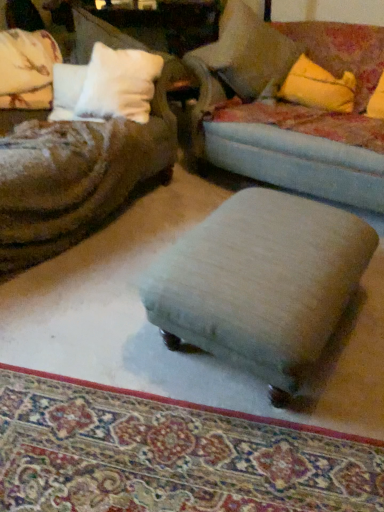
The width and height of the screenshot is (384, 512). What do you see at coordinates (169, 455) in the screenshot?
I see `beige fabric ottoman at center` at bounding box center [169, 455].

How much space does soft beige pillow at upper right, the second pillow in the left-to-right sequence, occupy vertically?

It is 25.10 inches.

What is the approximate height of yellow fabric pillow at upper right?

The height of yellow fabric pillow at upper right is 12.50 inches.

I want to click on velvet blue studio couch at center, so click(299, 162).

Is soft beige pillow at upper right, the second pillow in the left-to-right sequence, located outside velvet blue studio couch at center?

No, soft beige pillow at upper right, the second pillow in the left-to-right sequence, is not entirely external to velvet blue studio couch at center.

Considering the positions of objects soft beige pillow at upper right, the second pillow in the left-to-right sequence, and velvet blue studio couch at center in the image provided, who is in front, soft beige pillow at upper right, the second pillow in the left-to-right sequence, or velvet blue studio couch at center?

velvet blue studio couch at center.

From the image's perspective, which object appears higher, soft beige pillow at upper right, the second pillow in the left-to-right sequence, or velvet blue studio couch at center?

soft beige pillow at upper right, the second pillow in the left-to-right sequence, appears higher in the image.

Considering the positions of objects soft beige pillow at upper right, the second pillow in the left-to-right sequence, and velvet blue studio couch at center in the image provided, who is more to the left, soft beige pillow at upper right, the second pillow in the left-to-right sequence, or velvet blue studio couch at center?

soft beige pillow at upper right, the second pillow in the left-to-right sequence, is more to the left.

Between beige fabric ottoman at center and light beige fabric stool at center, which one has larger width?

light beige fabric stool at center.

How many degrees apart are the facing directions of beige fabric ottoman at center and light beige fabric stool at center?

The angle between the facing direction of beige fabric ottoman at center and the facing direction of light beige fabric stool at center is 159 degrees.

From a real-world perspective, is beige fabric ottoman at center above or below light beige fabric stool at center?

In terms of real-world spatial position, beige fabric ottoman at center is below light beige fabric stool at center.

Which is nearer, (314, 471) or (284, 317)?

Point (314, 471) appears to be farther away from the viewer than point (284, 317).

Would you say beige fabric ottoman at center is inside or outside soft beige pillow at upper right, arranged as the first pillow when viewed from the right?

beige fabric ottoman at center is outside soft beige pillow at upper right, arranged as the first pillow when viewed from the right.

From a real-world perspective, which object rests below the other?

beige fabric ottoman at center, from a real-world perspective.

Is beige fabric ottoman at center positioned far away from soft beige pillow at upper right, the second pillow in the left-to-right sequence?

That's right, there is a large distance between beige fabric ottoman at center and soft beige pillow at upper right, the second pillow in the left-to-right sequence.

Is point (370, 495) positioned before point (244, 66)?

Yes, point (370, 495) is closer to viewer.

Considering the relative sizes of velvet blue studio couch at center and light beige fabric stool at center in the image provided, is velvet blue studio couch at center bigger than light beige fabric stool at center?

Yes.

Is velvet blue studio couch at center positioned with its back to light beige fabric stool at center?

That's not correct — velvet blue studio couch at center is not looking away from light beige fabric stool at center.

Does velvet blue studio couch at center have a greater width compared to light beige fabric stool at center?

Indeed, velvet blue studio couch at center has a greater width compared to light beige fabric stool at center.

Can you confirm if velvet blue studio couch at center is positioned to the left of light beige fabric stool at center?

In fact, velvet blue studio couch at center is to the right of light beige fabric stool at center.

Is white soft pillow at upper left, which appears as the 1th pillow when viewed from the left, far away from yellow fabric pillow at upper right?

No, white soft pillow at upper left, which appears as the 1th pillow when viewed from the left, is not far away from yellow fabric pillow at upper right.

Would you say white soft pillow at upper left, which appears as the 1th pillow when viewed from the left, is to the left or to the right of yellow fabric pillow at upper right in the picture?

white soft pillow at upper left, which appears as the 1th pillow when viewed from the left, is to the left of yellow fabric pillow at upper right.

From a real-world perspective, is white soft pillow at upper left, which is the 2th pillow from right to left, positioned above or below yellow fabric pillow at upper right?

white soft pillow at upper left, which is the 2th pillow from right to left, is above yellow fabric pillow at upper right.

What are the coordinates of `throw pillow below the white soft pillow at upper left, which appears as the 1th pillow when viewed from the left (from a real-world perspective)` in the screenshot? It's located at (318, 87).

Which is closer, (226, 38) or (246, 52)?

Positioned in front is point (226, 38).

Is velvet blue studio couch at center with soft beige pillow at upper right, the second pillow in the left-to-right sequence?

No, velvet blue studio couch at center is not next to soft beige pillow at upper right, the second pillow in the left-to-right sequence.

Based on the photo, how many degrees apart are the facing directions of velvet blue studio couch at center and soft beige pillow at upper right, arranged as the first pillow when viewed from the right?

The angular difference between velvet blue studio couch at center and soft beige pillow at upper right, arranged as the first pillow when viewed from the right, is 9.23 degrees.

Based on the photo, measure the distance from velvet blue studio couch at center to soft beige pillow at upper right, the second pillow in the left-to-right sequence.

They are 5.38 inches apart.

Is velvet blue studio couch at center in front of yellow fabric pillow at upper right?

Yes, the depth of velvet blue studio couch at center is less than that of yellow fabric pillow at upper right.

From the image's perspective, which object appears higher, velvet blue studio couch at center or yellow fabric pillow at upper right?

yellow fabric pillow at upper right.

Is velvet blue studio couch at center facing away from yellow fabric pillow at upper right?

Yes, velvet blue studio couch at center is facing away from yellow fabric pillow at upper right.

In terms of size, does velvet blue studio couch at center appear bigger or smaller than yellow fabric pillow at upper right?

Considering their sizes, velvet blue studio couch at center takes up more space than yellow fabric pillow at upper right.

The width and height of the screenshot is (384, 512). Identify the location of the 1st pillow to the left of the velvet blue studio couch at center, starting your count from the anchor. (248, 52).

Locate an element on the screen. The image size is (384, 512). mat that is in front of the light beige fabric stool at center is located at coordinates (169, 455).

Looking at the image, which one is located closer to yellow fabric pillow at upper right, white soft pillow at upper left, which is the 2th pillow from right to left, or beige fabric ottoman at center?

white soft pillow at upper left, which is the 2th pillow from right to left, is closer to yellow fabric pillow at upper right.

Considering their positions, is yellow fabric pillow at upper right positioned further to beige fabric ottoman at center than velvet blue studio couch at center?

yellow fabric pillow at upper right is positioned further to the anchor beige fabric ottoman at center.

Estimate the real-world distances between objects in this image. Which object is closer to beige fabric ottoman at center, light beige fabric stool at center or white soft pillow at upper left, which is the 2th pillow from right to left?

light beige fabric stool at center is closer to beige fabric ottoman at center.

Considering their positions, is beige fabric ottoman at center positioned closer to light beige fabric stool at center than velvet blue studio couch at center?

Based on the image, beige fabric ottoman at center appears to be nearer to light beige fabric stool at center.

Looking at the image, which one is located further to yellow fabric pillow at upper right, beige fabric ottoman at center or soft beige pillow at upper right, arranged as the first pillow when viewed from the right?

beige fabric ottoman at center lies further to yellow fabric pillow at upper right than the other object.

Estimate the real-world distances between objects in this image. Which object is closer to yellow fabric pillow at upper right, white soft pillow at upper left, which appears as the 1th pillow when viewed from the left, or soft beige pillow at upper right, the second pillow in the left-to-right sequence?

The object closer to yellow fabric pillow at upper right is soft beige pillow at upper right, the second pillow in the left-to-right sequence.

Which object lies further to the anchor point velvet blue studio couch at center, soft beige pillow at upper right, arranged as the first pillow when viewed from the right, or yellow fabric pillow at upper right?

yellow fabric pillow at upper right lies further to velvet blue studio couch at center than the other object.

Based on their spatial positions, is beige fabric ottoman at center or light beige fabric stool at center closer to white soft pillow at upper left, which appears as the 1th pillow when viewed from the left?

Among the two, light beige fabric stool at center is located nearer to white soft pillow at upper left, which appears as the 1th pillow when viewed from the left.

Locate an element on the screen. studio couch between soft beige pillow at upper right, arranged as the first pillow when viewed from the right, and light beige fabric stool at center, in the vertical direction is located at coordinates (299, 162).

The width and height of the screenshot is (384, 512). Find the location of `pillow between soft beige pillow at upper right, arranged as the first pillow when viewed from the right, and light beige fabric stool at center, in the vertical direction`. pillow between soft beige pillow at upper right, arranged as the first pillow when viewed from the right, and light beige fabric stool at center, in the vertical direction is located at coordinates (119, 84).

Where is `pillow between velvet blue studio couch at center and beige fabric ottoman at center from top to bottom`? This screenshot has height=512, width=384. pillow between velvet blue studio couch at center and beige fabric ottoman at center from top to bottom is located at coordinates (119, 84).

The height and width of the screenshot is (512, 384). What are the coordinates of `pillow between white soft pillow at upper left, which appears as the 1th pillow when viewed from the left, and velvet blue studio couch at center, in the horizontal direction` in the screenshot? It's located at (248, 52).